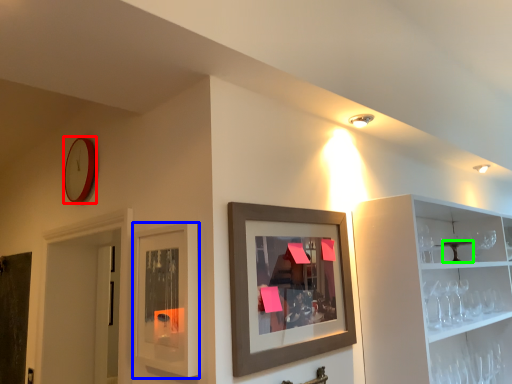
Question: Which object is positioned closest to clock (highlighted by a red box)? Select from cabinet (highlighted by a blue box) and table (highlighted by a green box).

Choices:
 (A) cabinet
 (B) table

Answer: (A)